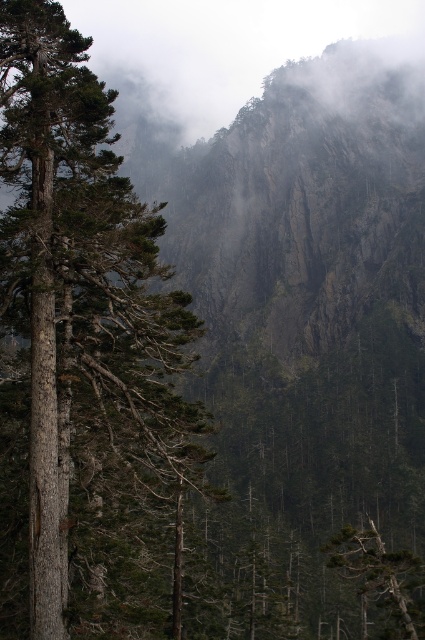
Question: Is brown textured tree trunk at left above green matte tree at lower right?

Choices:
 (A) yes
 (B) no

Answer: (A)

Question: Which of the following is the closest to the observer?

Choices:
 (A) (132, 396)
 (B) (353, 547)

Answer: (A)

Question: Does brown textured tree trunk at left have a lesser width compared to green matte tree at lower right?

Choices:
 (A) yes
 (B) no

Answer: (B)

Question: Does brown textured tree trunk at left come behind green matte tree at lower right?

Choices:
 (A) yes
 (B) no

Answer: (B)

Question: Which object is closer to the camera taking this photo?

Choices:
 (A) brown textured tree trunk at left
 (B) green matte tree at lower right

Answer: (A)